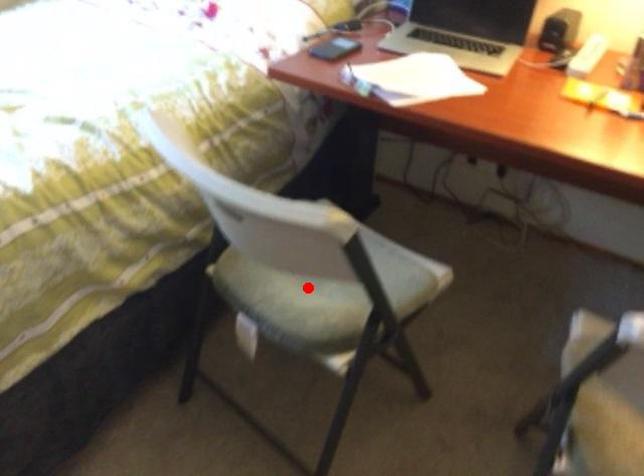
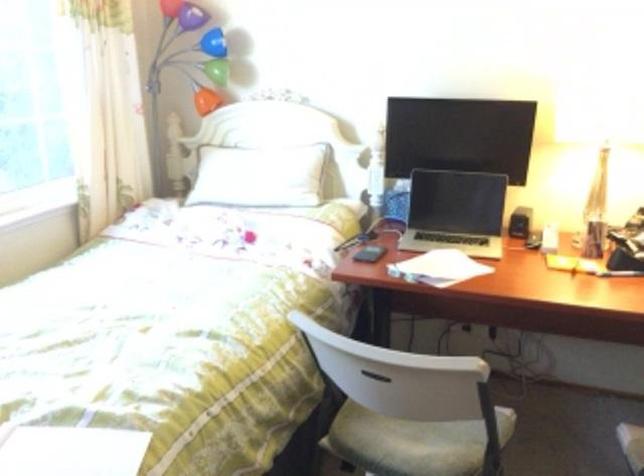
Where in the second image is the point corresponding to the highlighted location from the first image?

(413, 442)